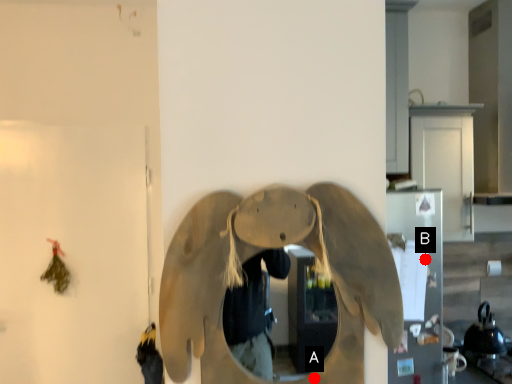
Question: Two points are circled on the image, labeled by A and B beside each circle. Among these points, which one is farthest from the camera?

Choices:
 (A) A is further
 (B) B is further

Answer: (B)